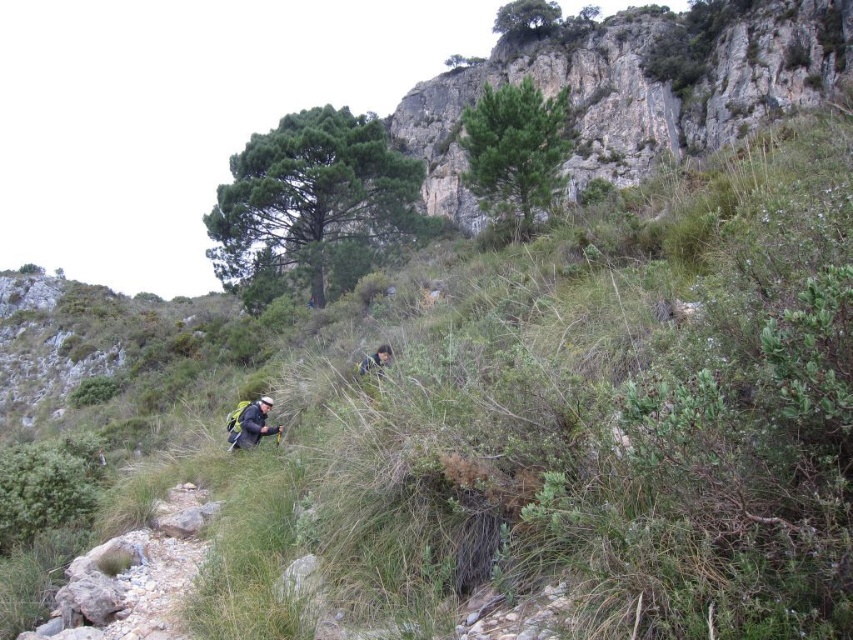
You are a hiker trying to navigate the rocky path. There is a rough textured rock at upper center and a camouflage fabric person at lower center. Which object is taller?

The rough textured rock at upper center is taller than the camouflage fabric person at lower center according to the description.

You are a hiker planning to join the group on the trail. You see the dark gray jacket at lower left and the camouflage fabric person at lower center. How far apart are these two hikers?

The dark gray jacket at lower left and the camouflage fabric person at lower center are 20.15 feet apart.